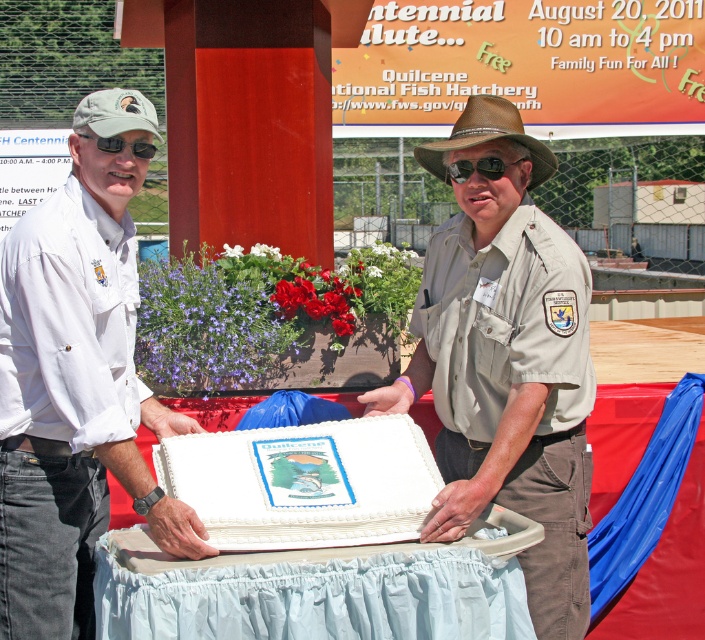
Question: Among these points, which one is farthest from the camera?

Choices:
 (A) (337, 625)
 (B) (99, 147)
 (C) (0, 484)

Answer: (B)

Question: From the image, what is the correct spatial relationship of white matte cake at center in relation to white frosted cake at center?

Choices:
 (A) right
 (B) left

Answer: (A)

Question: Based on their relative distances, which object is nearer to the black matte sunglasses at upper left?

Choices:
 (A) white plastic tray at center
 (B) sunglasses at center

Answer: (B)

Question: Which of the following is the closest to the observer?

Choices:
 (A) (563, 369)
 (B) (137, 154)
 (C) (513, 547)
 (D) (85, 600)

Answer: (C)

Question: Does white plastic tray at center lie behind black matte sunglasses at upper left?

Choices:
 (A) yes
 (B) no

Answer: (B)

Question: In this image, where is tan uniform at center located relative to white matte shirt at left?

Choices:
 (A) above
 (B) below

Answer: (B)